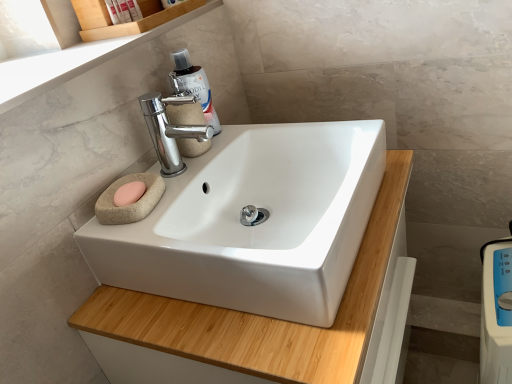
Find the location of a particular element. Image resolution: width=512 pixels, height=384 pixels. blank area to the left of white plastic bottle at upper left, placed as the first toiletry when sorted from right to left is located at coordinates (62, 48).